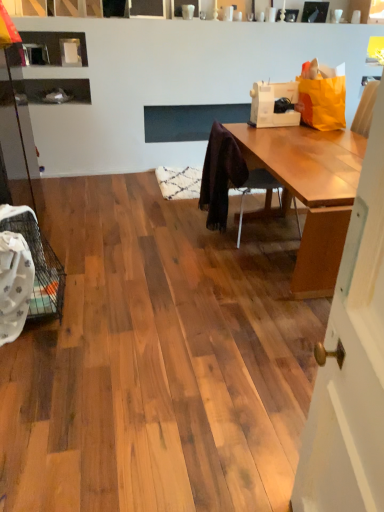
At what (x,y) coordinates should I click in order to perform the action: click on free spot below wooden chair at center (from a real-world perspective). Please return your answer as a coordinate pair (x, y). The image size is (384, 512). Looking at the image, I should click on (249, 234).